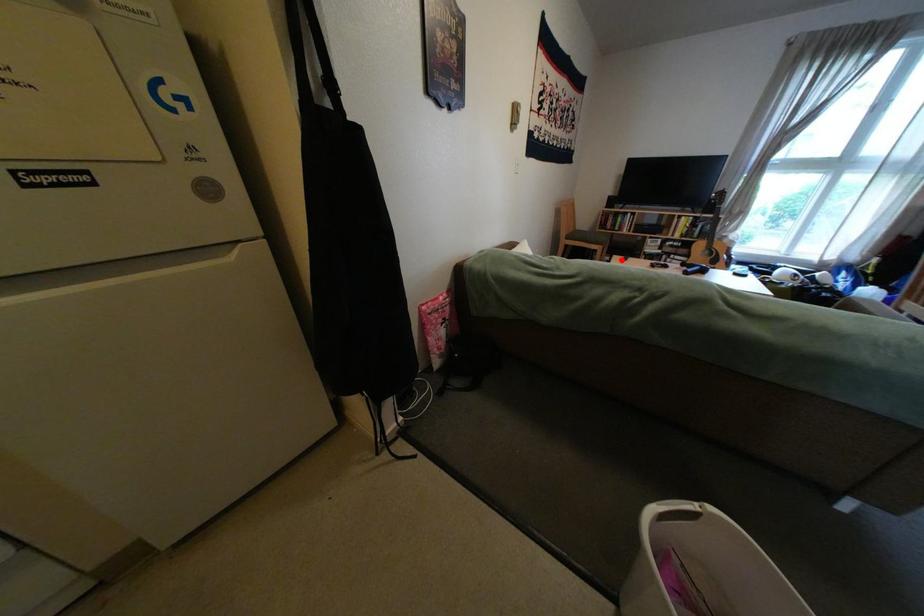
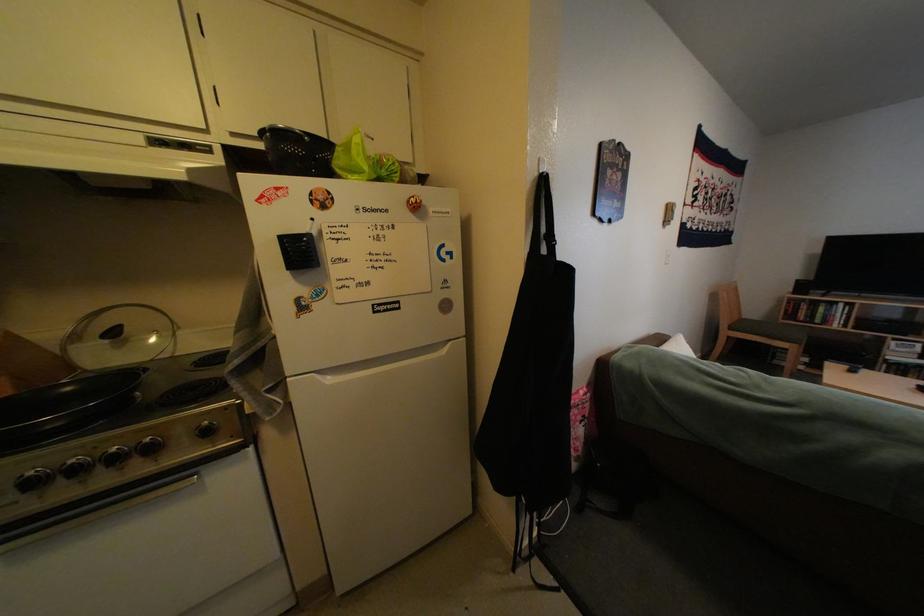
Question: I am providing you with two images of the same scene from different viewpoints. In image1, a red point is highlighted. Considering the same 3D point in image2, which of the following is correct?

Choices:
 (A) It is closer
 (B) It is farther

Answer: (A)